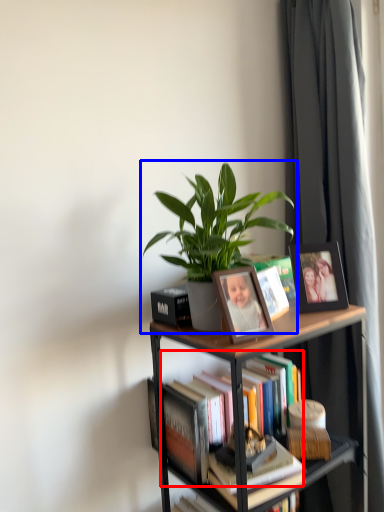
Question: Which point is closer to the camera, book (highlighted by a red box) or houseplant (highlighted by a blue box)?

Choices:
 (A) book
 (B) houseplant

Answer: (B)